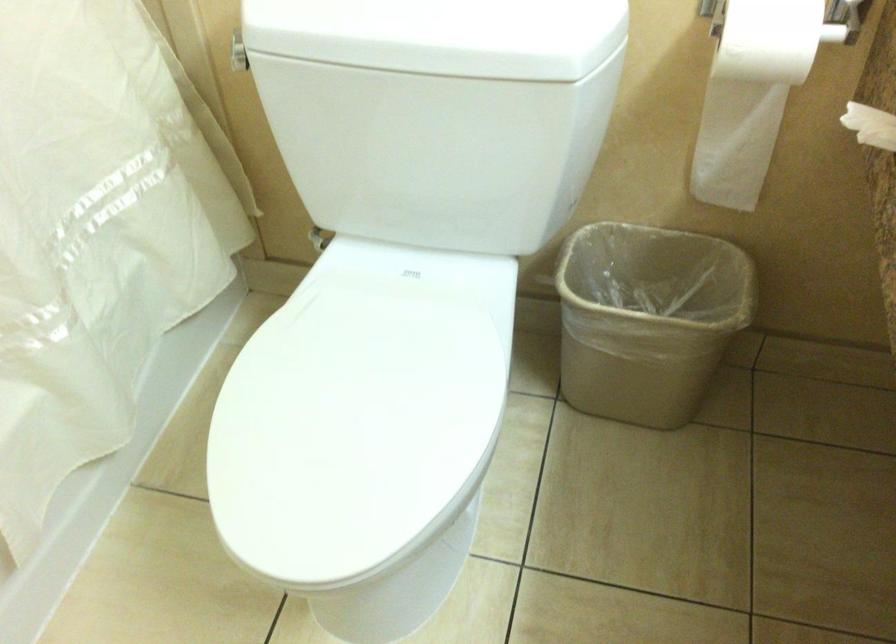
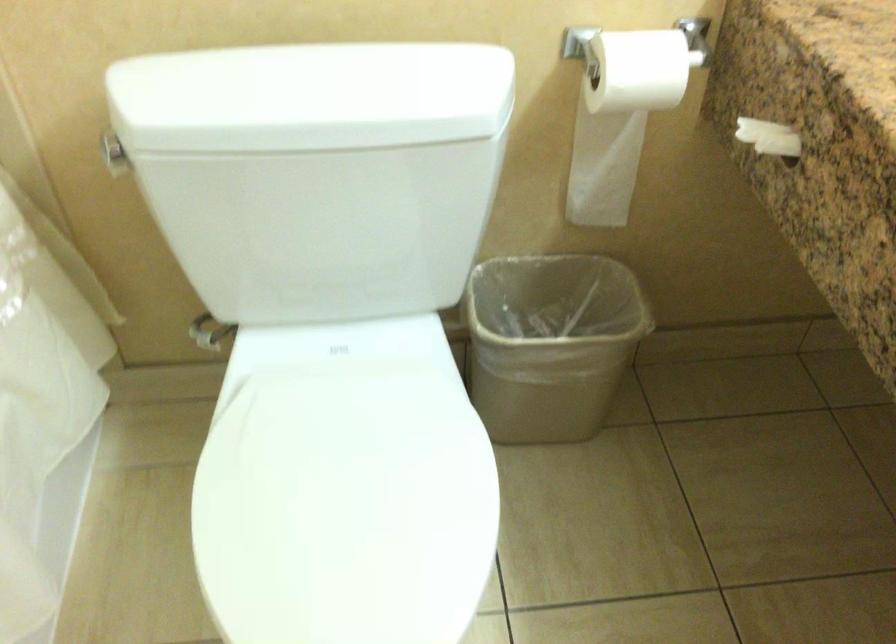
Question: The camera is either moving clockwise (left) or counter-clockwise (right) around the object. The first image is from the beginning of the video and the second image is from the end. Is the camera moving left or right when shooting the video?

Choices:
 (A) Left
 (B) Right

Answer: (A)